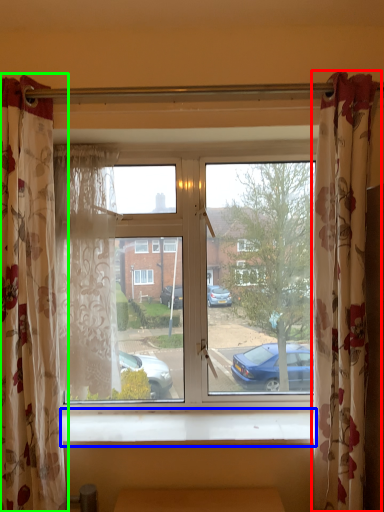
Question: Based on their relative distances, which object is nearer to curtain (highlighted by a red box)? Choose from window sill (highlighted by a blue box) and curtain (highlighted by a green box).

Choices:
 (A) window sill
 (B) curtain

Answer: (A)